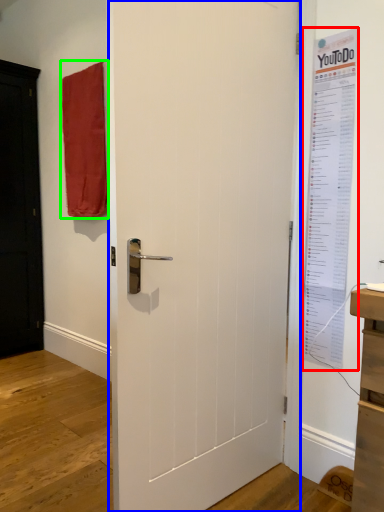
Question: Estimate the real-world distances between objects in this image. Which object is closer to poster page (highlighted by a red box), door (highlighted by a blue box) or curtain (highlighted by a green box)?

Choices:
 (A) door
 (B) curtain

Answer: (A)